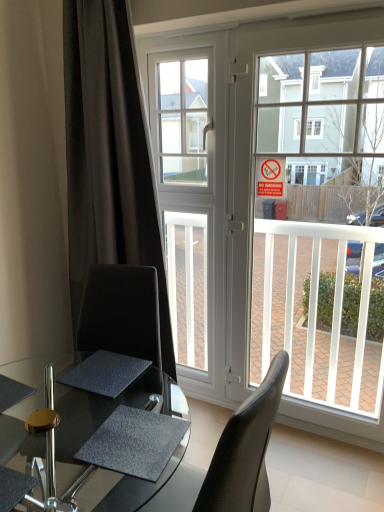
Question: Are white glass window at center and dark matte curtain at left located far from each other?

Choices:
 (A) yes
 (B) no

Answer: (B)

Question: From a real-world perspective, is white glass window at center on dark matte curtain at left?

Choices:
 (A) no
 (B) yes

Answer: (B)

Question: Is white glass window at center outside dark matte curtain at left?

Choices:
 (A) no
 (B) yes

Answer: (B)

Question: Is white glass window at center further to the viewer compared to dark matte curtain at left?

Choices:
 (A) yes
 (B) no

Answer: (A)

Question: Does white glass window at center touch dark matte curtain at left?

Choices:
 (A) yes
 (B) no

Answer: (B)

Question: Is transparent glass table at center inside or outside of clear glass door at center?

Choices:
 (A) inside
 (B) outside

Answer: (B)

Question: In the image, is transparent glass table at center on the left side or the right side of clear glass door at center?

Choices:
 (A) left
 (B) right

Answer: (A)

Question: From the image's perspective, is transparent glass table at center above or below clear glass door at center?

Choices:
 (A) above
 (B) below

Answer: (B)

Question: From their relative heights in the image, would you say transparent glass table at center is taller or shorter than clear glass door at center?

Choices:
 (A) short
 (B) tall

Answer: (A)

Question: Is dark matte curtain at left inside the boundaries of clear glass door at center, or outside?

Choices:
 (A) inside
 (B) outside

Answer: (B)

Question: Is point (132, 193) closer or farther from the camera than point (312, 241)?

Choices:
 (A) closer
 (B) farther

Answer: (A)

Question: From the image's perspective, is dark matte curtain at left positioned above or below clear glass door at center?

Choices:
 (A) above
 (B) below

Answer: (A)

Question: Visually, is dark matte curtain at left positioned to the left or to the right of clear glass door at center?

Choices:
 (A) left
 (B) right

Answer: (A)

Question: Looking at their shapes, would you say clear glass door at center is wider or thinner than transparent glass table at center?

Choices:
 (A) wide
 (B) thin

Answer: (B)

Question: Based on their positions, is clear glass door at center located to the left or right of transparent glass table at center?

Choices:
 (A) right
 (B) left

Answer: (A)